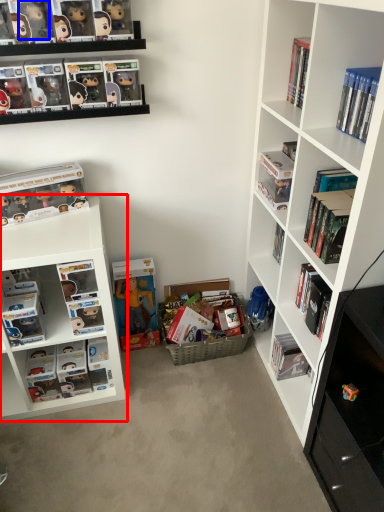
Question: Which point is further to the camera, bookshelf (highlighted by a red box) or toy (highlighted by a blue box)?

Choices:
 (A) bookshelf
 (B) toy

Answer: (A)